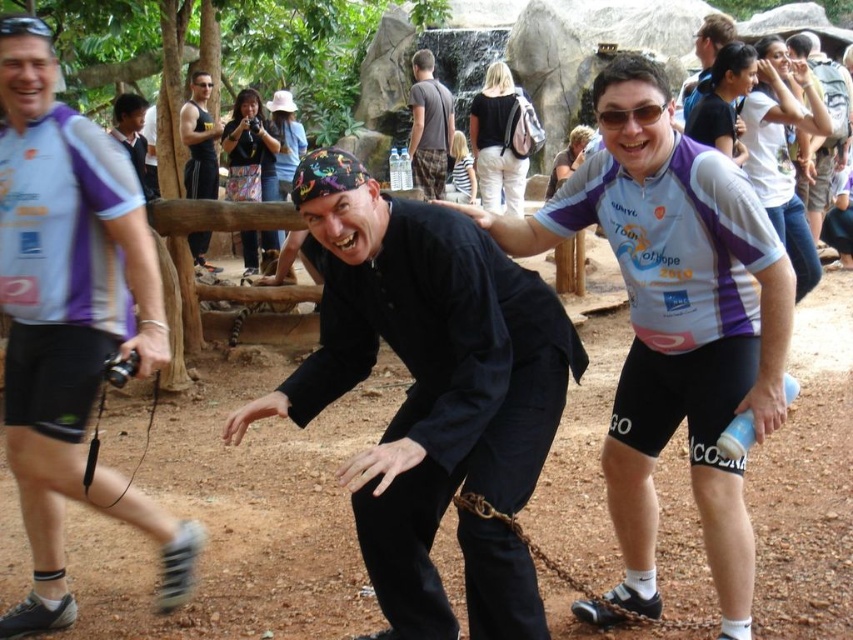
What is located at the coordinates point (x=502, y=140) in the image?

The point (x=502, y=140) indicates white cotton pants at center.

You are a security guard at the zoo and need to locate the matte black shirt at center in the image. According to the coordinates provided, where would you find it?

The matte black shirt at center is located at point (706,56).